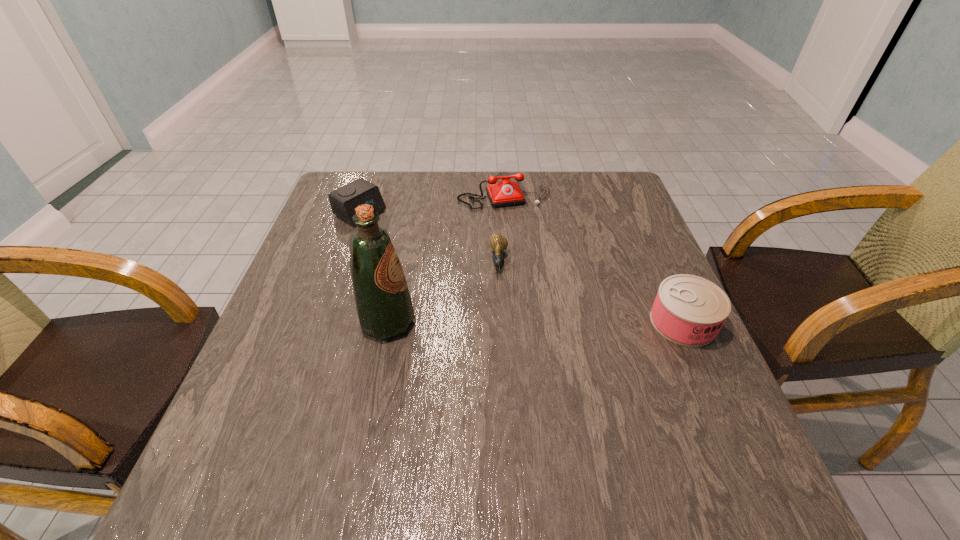
Where is `blank area located 0.240m on the front-facing side of the alarm clock`? This screenshot has height=540, width=960. blank area located 0.240m on the front-facing side of the alarm clock is located at coordinates (438, 260).

Identify the location of vacant space situated on the front-facing side of the alarm clock. Image resolution: width=960 pixels, height=540 pixels. (444, 263).

This screenshot has height=540, width=960. I want to click on free space located 0.100m on the dial of the telephone, so click(523, 232).

Image resolution: width=960 pixels, height=540 pixels. Identify the location of free spot located on the dial of the telephone. (535, 257).

Where is `free spot located on the dial of the telephone`? The width and height of the screenshot is (960, 540). free spot located on the dial of the telephone is located at coordinates (518, 221).

The height and width of the screenshot is (540, 960). Find the location of `free space located 0.250m on the front-facing side of the shortest object`. free space located 0.250m on the front-facing side of the shortest object is located at coordinates (495, 361).

Where is `vacant position located on the front-facing side of the shortest object`? The image size is (960, 540). vacant position located on the front-facing side of the shortest object is located at coordinates (493, 396).

You are a GUI agent. You are given a task and a screenshot of the screen. Output one action in this format:
    pyautogui.click(x=<x>, y=<y>)
    Task: Click on the vacant space located on the front-facing side of the shortest object
    Image resolution: width=960 pixels, height=540 pixels.
    Given the screenshot: What is the action you would take?
    pyautogui.click(x=495, y=357)

The width and height of the screenshot is (960, 540). I want to click on alarm clock present at the far edge, so click(344, 200).

This screenshot has width=960, height=540. Find the location of `telephone present at the far edge`. telephone present at the far edge is located at coordinates (x=504, y=193).